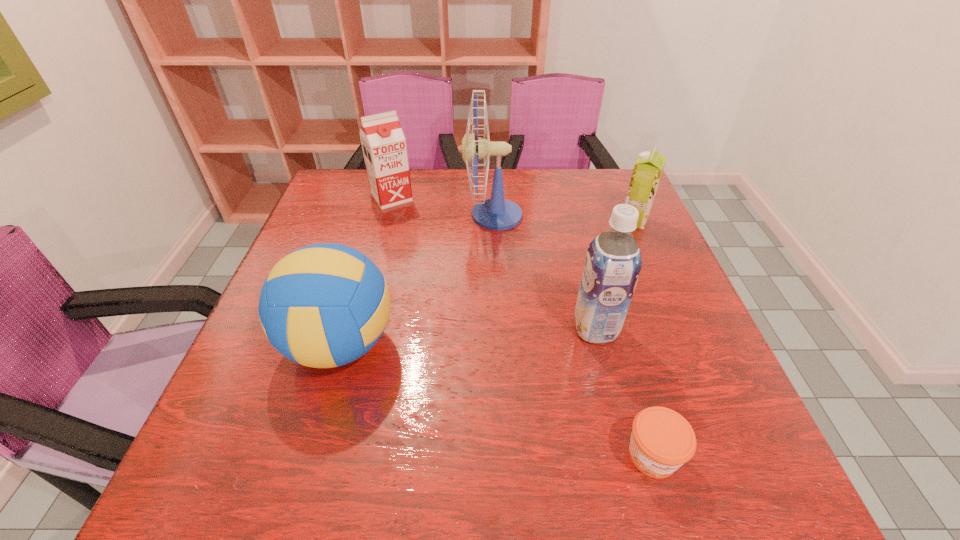
You are a GUI agent. You are given a task and a screenshot of the screen. Output one action in this format:
    pyautogui.click(x=<x>, y=<y>)
    Task: Click on the object that is at the near edge
    This screenshot has height=540, width=960.
    Given the screenshot: What is the action you would take?
    pyautogui.click(x=662, y=440)

Image resolution: width=960 pixels, height=540 pixels. Find the location of `soya milk present at the left edge`. soya milk present at the left edge is located at coordinates (384, 148).

I want to click on volleyball situated at the left edge, so click(x=325, y=305).

This screenshot has width=960, height=540. Identify the location of soya milk that is at the right edge. (649, 166).

Where is `jam that is at the right edge`? The image size is (960, 540). jam that is at the right edge is located at coordinates (662, 440).

Where is `object located in the far left corner section of the desktop`? This screenshot has width=960, height=540. object located in the far left corner section of the desktop is located at coordinates (384, 148).

The image size is (960, 540). Find the location of `object at the far right corner`. object at the far right corner is located at coordinates (649, 166).

You are a GUI agent. You are given a task and a screenshot of the screen. Output one action in this format:
    pyautogui.click(x=<x>, y=<y>)
    Task: Click on the object that is at the near right corner
    The width and height of the screenshot is (960, 540).
    Given the screenshot: What is the action you would take?
    pyautogui.click(x=662, y=440)

Image resolution: width=960 pixels, height=540 pixels. I want to click on vacant area at the far edge, so click(503, 170).

The image size is (960, 540). I want to click on vacant space at the near edge, so click(x=384, y=496).